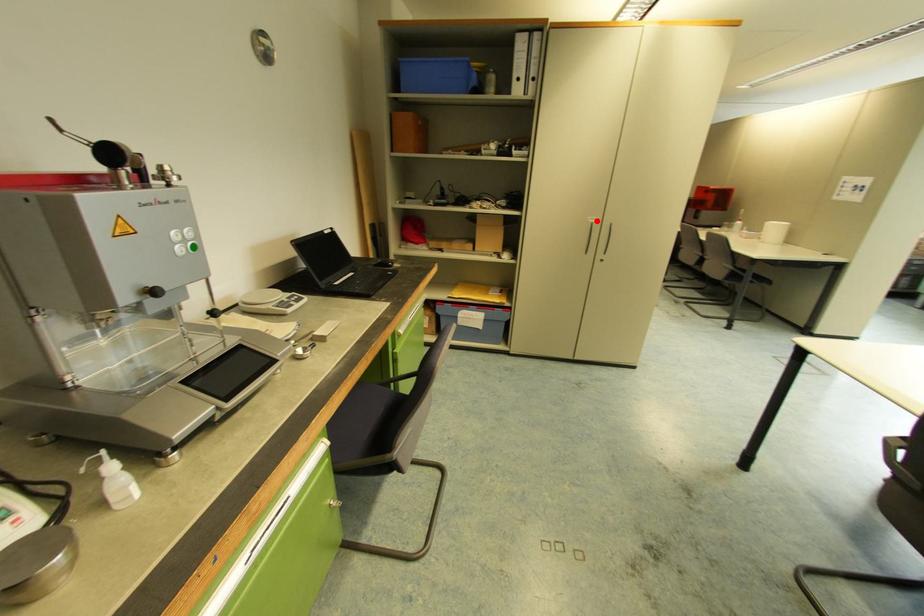
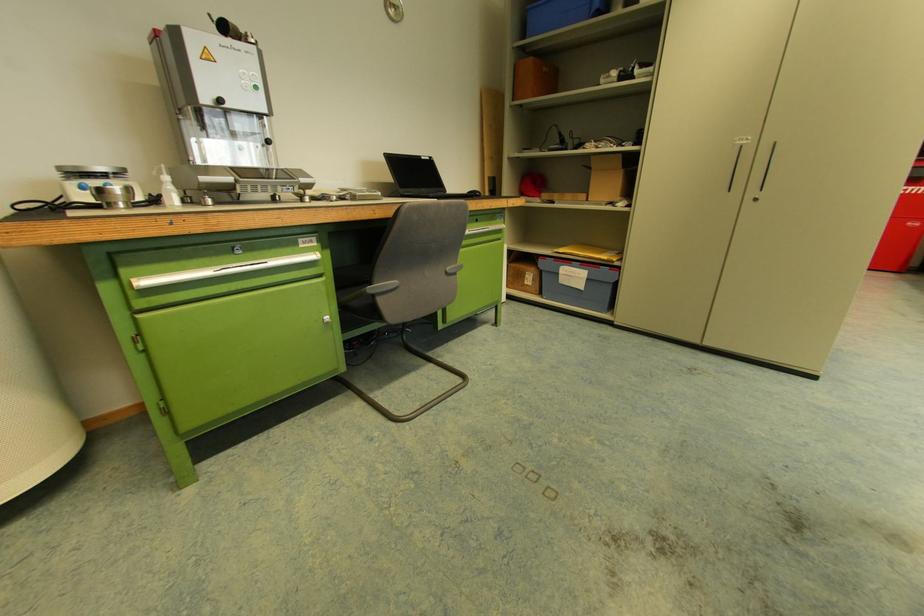
The point at the highlighted location is marked in the first image. Where is the corresponding point in the second image?

(748, 142)